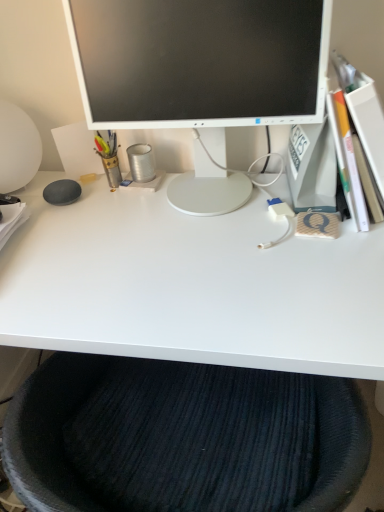
Identify the location of blank space to the left of metallic canister at center, which is the first stationery in right-to-left order. The width and height of the screenshot is (384, 512). (88, 185).